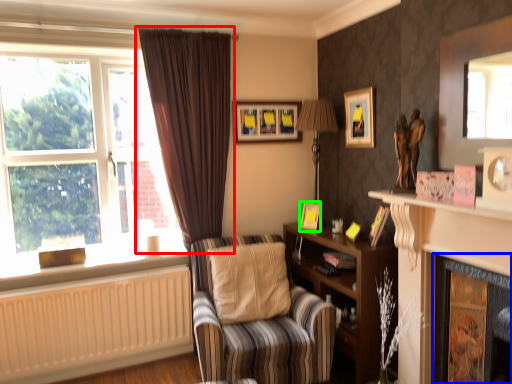
Question: Considering the real-world distances, which object is closest to curtain (highlighted by a red box)? fireplace (highlighted by a blue box) or picture frame (highlighted by a green box).

Choices:
 (A) fireplace
 (B) picture frame

Answer: (B)